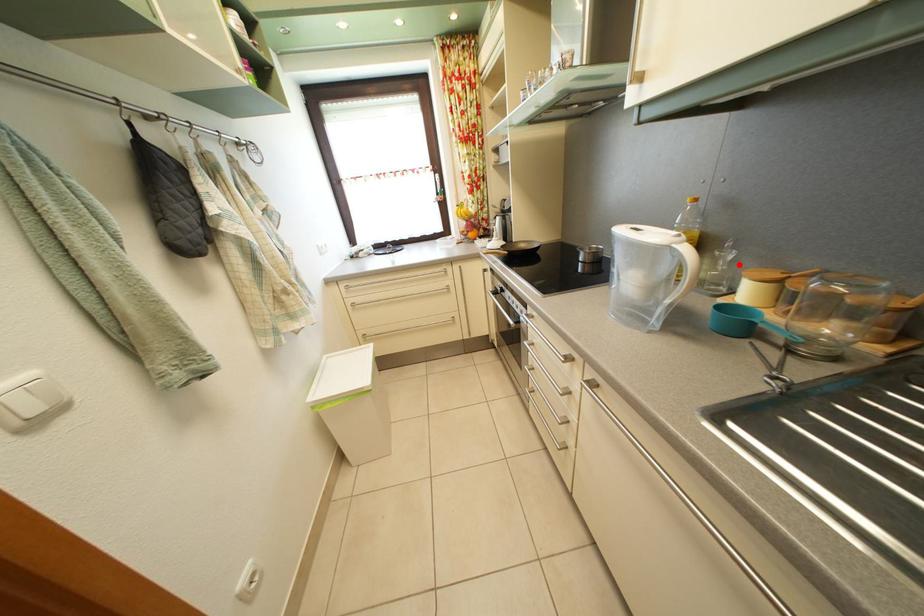
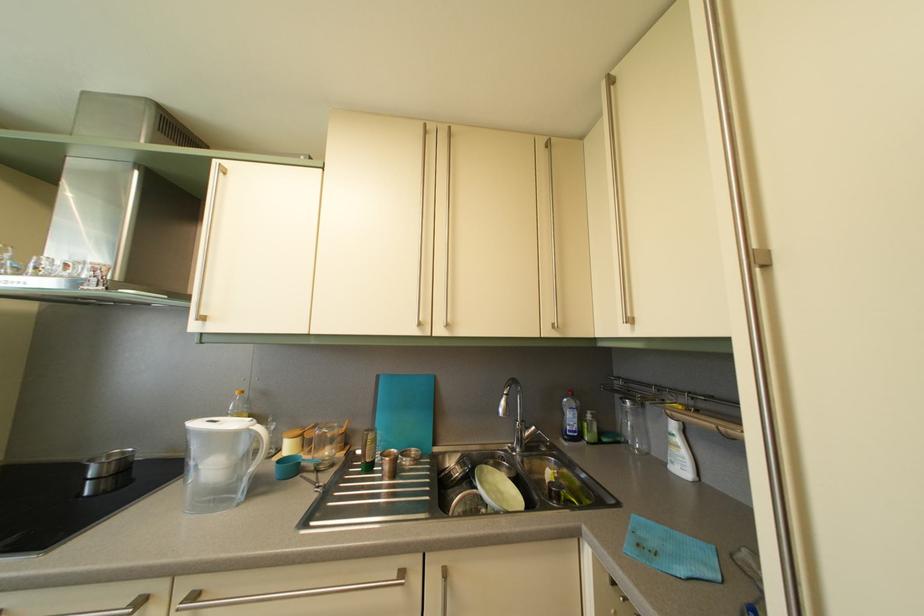
Where in the second image is the point corresponding to the highlighted location from the first image?

(282, 435)